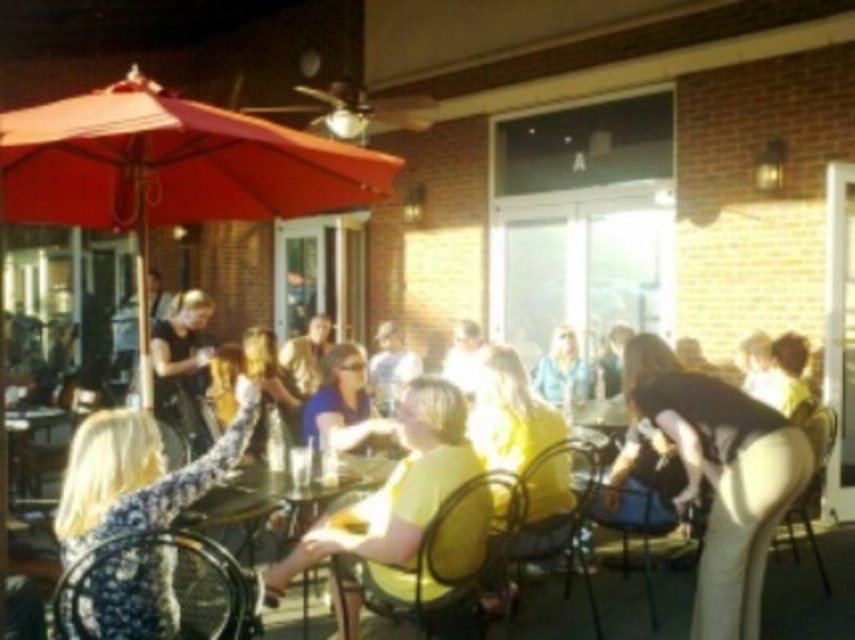
Who is positioned more to the left, metallic mesh chair at center or metallic blue chair at lower right?

Positioned to the left is metallic mesh chair at center.

Is metallic mesh chair at center smaller than metallic blue chair at lower right?

Actually, metallic mesh chair at center might be larger than metallic blue chair at lower right.

Which is behind, point (486, 557) or point (634, 506)?

Positioned behind is point (634, 506).

I want to click on metallic mesh chair at center, so [x=451, y=561].

Can you confirm if metallic yellow chair at center is taller than matte black shirt at center?

Yes.

Which is more to the right, metallic yellow chair at center or matte black shirt at center?

metallic yellow chair at center

Identify the location of metallic yellow chair at center. The height and width of the screenshot is (640, 855). (558, 512).

Is black matte shirt at lower right to the left of floral fabric dress at left from the viewer's perspective?

No, black matte shirt at lower right is not to the left of floral fabric dress at left.

Is black matte shirt at lower right shorter than floral fabric dress at left?

No, black matte shirt at lower right is not shorter than floral fabric dress at left.

Where is `black matte shirt at lower right`? This screenshot has width=855, height=640. black matte shirt at lower right is located at coordinates (721, 476).

At what (x,y) coordinates should I click in order to perform the action: click on black matte shirt at lower right. Please return your answer as a coordinate pair (x, y). This screenshot has width=855, height=640. Looking at the image, I should click on (721, 476).